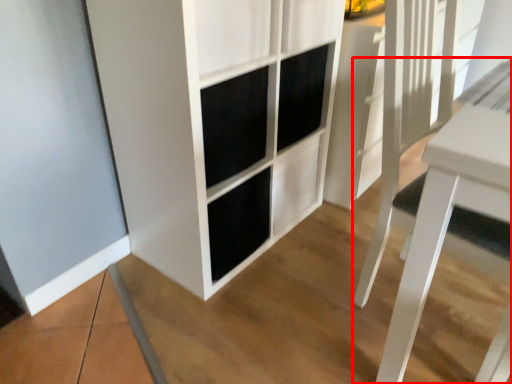
Question: From the image's perspective, where is table (annotated by the red box) located in relation to cupboard in the image?

Choices:
 (A) below
 (B) above

Answer: (A)